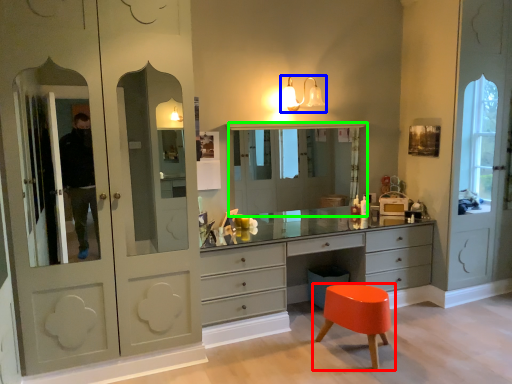
Question: Based on their relative distances, which object is farther from stool (highlighted by a red box)? Choose from light fixture (highlighted by a blue box) and medicine cabinet (highlighted by a green box).

Choices:
 (A) light fixture
 (B) medicine cabinet

Answer: (B)